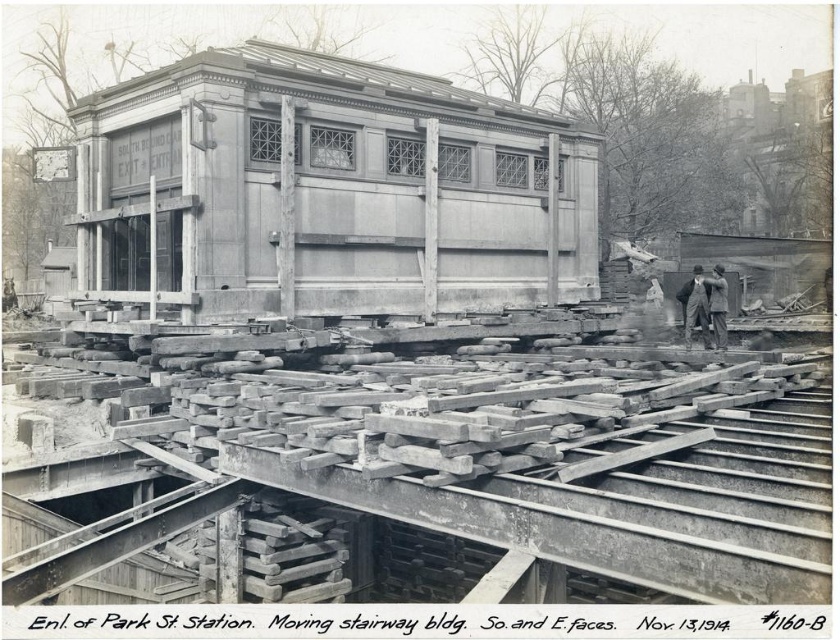
Can you confirm if wooden planks at center is bigger than dark gray suit at center?

Yes.

Does wooden planks at center appear on the right side of dark gray suit at center?

Incorrect, wooden planks at center is not on the right side of dark gray suit at center.

This screenshot has height=640, width=840. I want to click on wooden planks at center, so click(x=447, y=456).

Measure the distance between wooden planks at center and wooden structure at center.

wooden planks at center is 3.61 meters away from wooden structure at center.

Between point (709, 371) and point (378, 163), which one is positioned in front?

Point (709, 371) is more forward.

I want to click on wooden planks at center, so click(447, 456).

Is the position of wooden structure at center more distant than that of dark gray suit at center?

That is False.

What do you see at coordinates (326, 192) in the screenshot?
I see `wooden structure at center` at bounding box center [326, 192].

Which is in front, point (150, 228) or point (686, 308)?

Point (150, 228) is in front.

The width and height of the screenshot is (840, 640). Find the location of `wooden structure at center`. wooden structure at center is located at coordinates (326, 192).